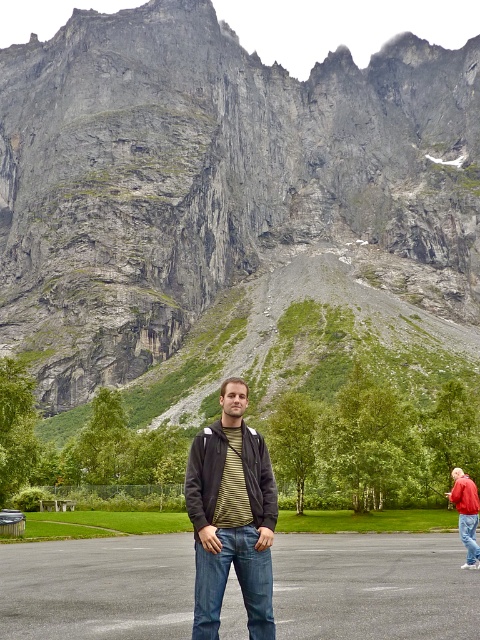
You are a photographer trying to capture a photo of the two people in the scene. If you want to ensure both the striped knit sweater at center and the red leather jacket at lower right are fully visible in the frame, which person should you focus on first?

The striped knit sweater at center is taller than the red leather jacket at lower right, so you should focus on the person wearing the striped knit sweater at center first to ensure their full height is captured in the frame before adjusting for the shorter individual.

You are a photographer taking a picture of the rugged granite mountain at upper center and the red leather jacket at lower right. Which object will appear closer to the camera in the photo?

The red leather jacket at lower right will appear closer to the camera in the photo because it is closer to the viewer than the rugged granite mountain at upper center.

You are a photographer trying to capture a photo of the two people in the scene. The blue denim jeans at center and the red leather jacket at lower right are your subjects. Based on their positions, which subject is closer to the camera?

The blue denim jeans at center is located below the red leather jacket at lower right, meaning the red leather jacket at lower right is closer to the camera.